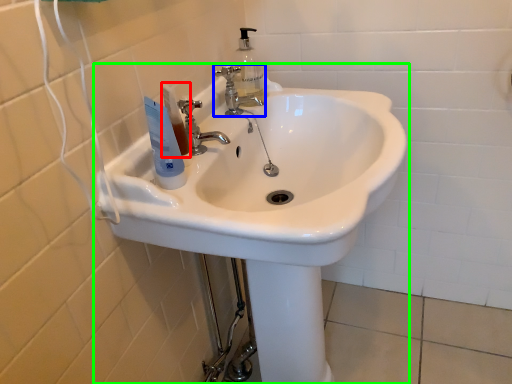
Question: Which object is the farthest from toiletry (highlighted by a red box)? Choose among these: tap (highlighted by a blue box) or sink (highlighted by a green box).

Choices:
 (A) tap
 (B) sink

Answer: (A)